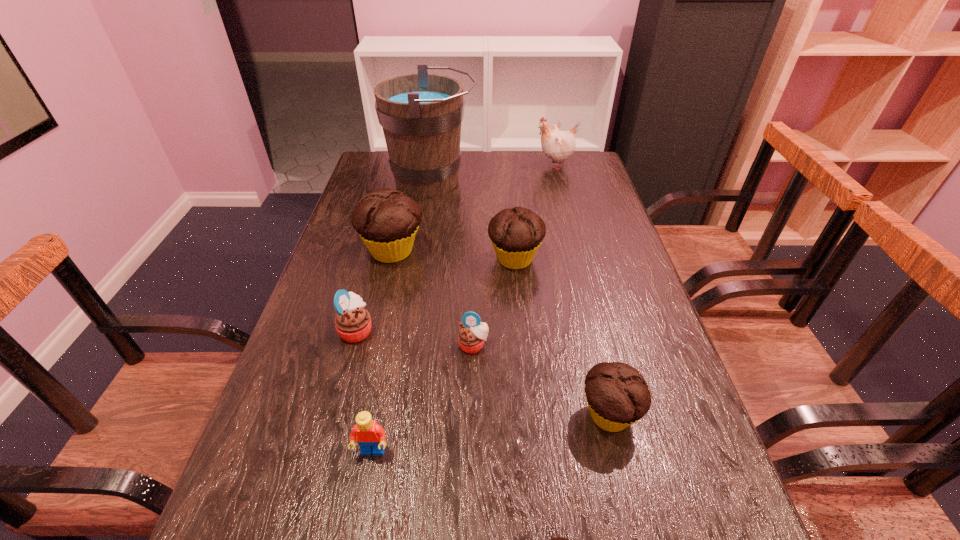
You are a GUI agent. You are given a task and a screenshot of the screen. Output one action in this format:
    pyautogui.click(x=<x>, y=<y>)
    Task: Click on the wine bucket
    The width and height of the screenshot is (960, 540).
    Given the screenshot: What is the action you would take?
    pyautogui.click(x=421, y=114)

You are a GUI agent. You are given a task and a screenshot of the screen. Output one action in this format:
    pyautogui.click(x=<x>, y=<y>)
    Task: Click on the bird
    The width and height of the screenshot is (960, 540).
    Given the screenshot: What is the action you would take?
    pyautogui.click(x=557, y=145)

This screenshot has height=540, width=960. Find the location of `the biggest chocolate muffin`. the biggest chocolate muffin is located at coordinates (387, 220).

In order to click on the leftmost chocolate muffin in this screenshot , I will do `click(387, 220)`.

The image size is (960, 540). I want to click on the second tallest muffin, so click(516, 234).

The image size is (960, 540). Find the location of `the fourth tallest object`. the fourth tallest object is located at coordinates (516, 234).

You are a GUI agent. You are given a task and a screenshot of the screen. Output one action in this format:
    pyautogui.click(x=<x>, y=<y>)
    Task: Click on the left pink muffin
    This screenshot has height=540, width=960.
    Given the screenshot: What is the action you would take?
    pyautogui.click(x=353, y=323)

I want to click on the second smallest chocolate muffin, so click(x=617, y=394).

The height and width of the screenshot is (540, 960). What are the coordinates of `the second nearest chocolate muffin` in the screenshot? It's located at (617, 394).

The image size is (960, 540). I want to click on Lego, so click(368, 434).